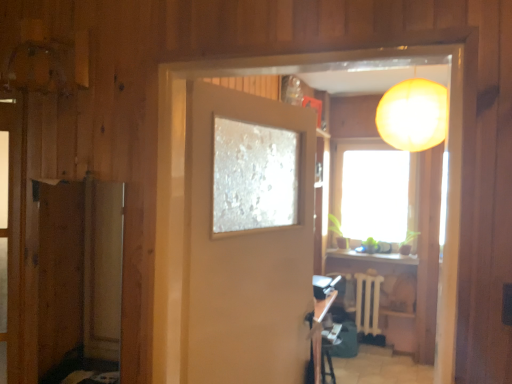
Question: Is wooden table at lower center surrounded by wooden screen door at left?

Choices:
 (A) no
 (B) yes

Answer: (A)

Question: Is wooden screen door at left to the left of wooden table at lower center from the viewer's perspective?

Choices:
 (A) yes
 (B) no

Answer: (A)

Question: From a real-world perspective, is wooden screen door at left beneath wooden table at lower center?

Choices:
 (A) no
 (B) yes

Answer: (A)

Question: Is the depth of wooden screen door at left greater than that of wooden table at lower center?

Choices:
 (A) no
 (B) yes

Answer: (A)

Question: Is wooden table at lower center at the back of wooden screen door at left?

Choices:
 (A) yes
 (B) no

Answer: (A)

Question: Is wooden screen door at left situated inside wooden table at lower center or outside?

Choices:
 (A) inside
 (B) outside

Answer: (B)

Question: In terms of height, does wooden screen door at left look taller or shorter compared to wooden table at lower center?

Choices:
 (A) tall
 (B) short

Answer: (A)

Question: Considering their positions, is wooden screen door at left located in front of or behind wooden table at lower center?

Choices:
 (A) behind
 (B) front

Answer: (B)

Question: Is point (75, 284) closer or farther from the camera than point (313, 311)?

Choices:
 (A) closer
 (B) farther

Answer: (B)

Question: Would you say transparent glass window at center is inside or outside wooden table at lower center?

Choices:
 (A) outside
 (B) inside

Answer: (A)

Question: In terms of width, does transparent glass window at center look wider or thinner when compared to wooden table at lower center?

Choices:
 (A) wide
 (B) thin

Answer: (B)

Question: Is transparent glass window at center taller or shorter than wooden table at lower center?

Choices:
 (A) short
 (B) tall

Answer: (B)

Question: Considering their positions, is transparent glass window at center located in front of or behind wooden table at lower center?

Choices:
 (A) behind
 (B) front

Answer: (A)

Question: Is matte orange lampshade at upper right spatially inside white plastic radiator at center, or outside of it?

Choices:
 (A) outside
 (B) inside

Answer: (A)

Question: In terms of height, does matte orange lampshade at upper right look taller or shorter compared to white plastic radiator at center?

Choices:
 (A) short
 (B) tall

Answer: (B)